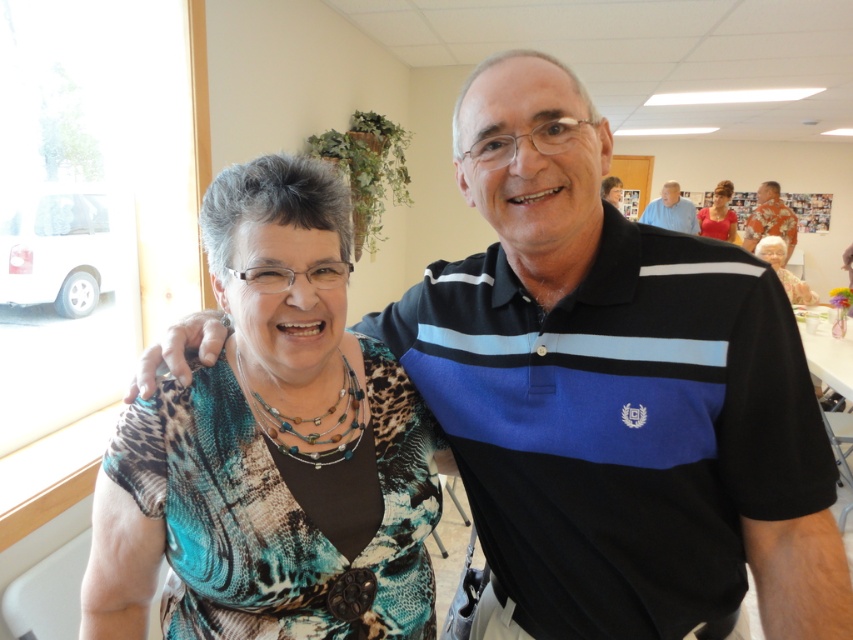
You are standing in the room and want to take a photo of the point at coordinates [676,520]. Is this point within your camera frame?

The point at coordinates [676,520] is 33.11 inches from the camera, so it is within the camera frame.

Based on the scene description, if someone is looking for the person wearing the black striped polo shirt at center, where should they look relative to the person with matte black hair at upper right?

The black striped polo shirt at center is located to the left of the matte black hair at upper right, so they should look to the left side of the person with matte black hair at upper right.